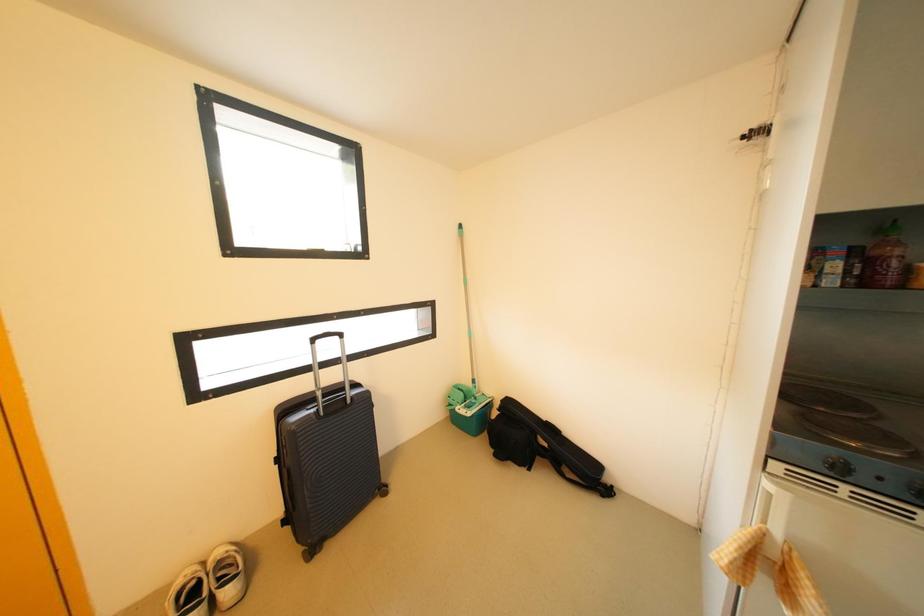
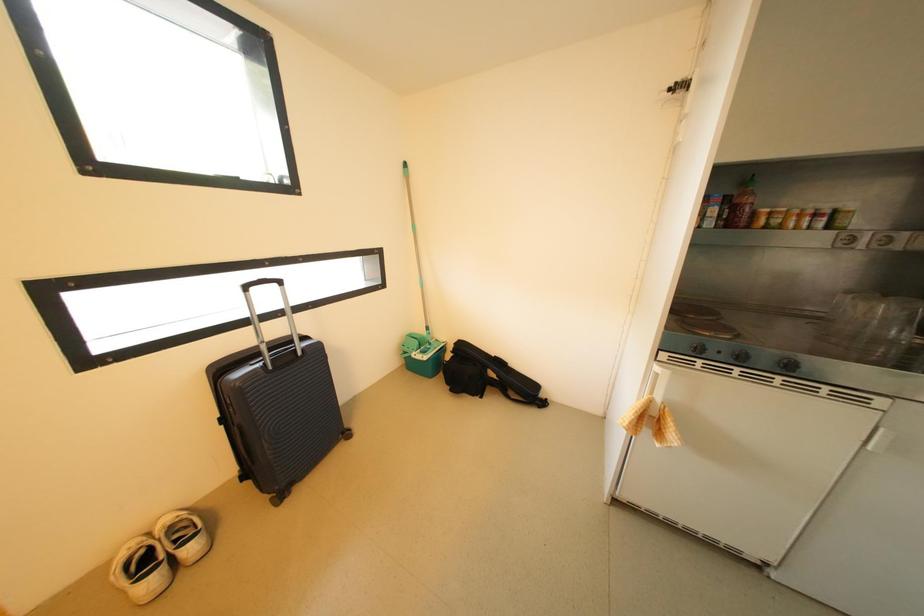
Question: Which direction would the cameraman need to move to produce the second image? Reply with the corresponding letter.

Choices:
 (A) Left
 (B) Right
 (C) Forward
 (D) Backward

Answer: (A)